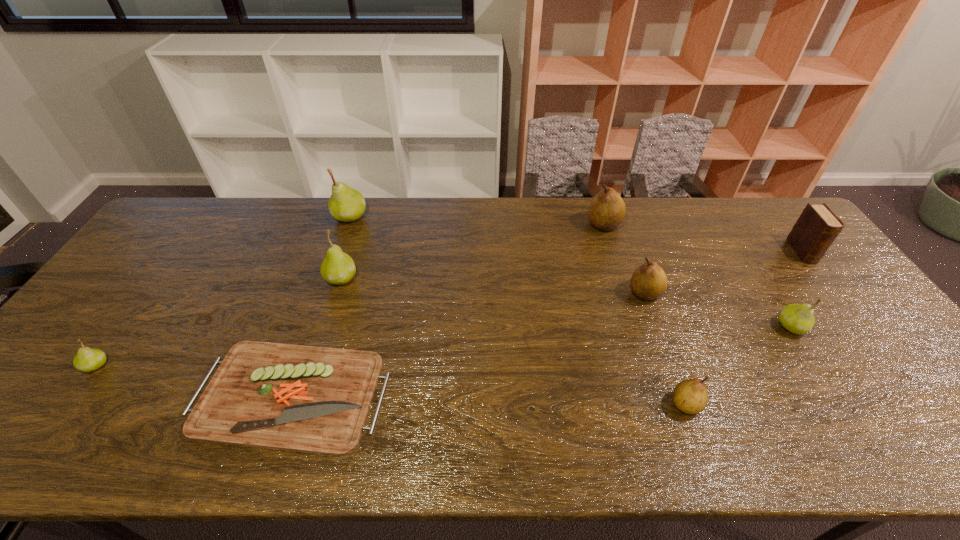
Locate an element on the screen. The height and width of the screenshot is (540, 960). free space between the leftmost object and the chopping board is located at coordinates (193, 380).

Find the location of `vacant point located between the third nearest green pear and the third farthest green pear`. vacant point located between the third nearest green pear and the third farthest green pear is located at coordinates (566, 302).

Where is `vacant point located between the seventh nearest object and the second nearest brown pear`? The width and height of the screenshot is (960, 540). vacant point located between the seventh nearest object and the second nearest brown pear is located at coordinates (724, 272).

The height and width of the screenshot is (540, 960). Identify the location of object that is the third closest to the shortest object. (346, 204).

You are a GUI agent. You are given a task and a screenshot of the screen. Output one action in this format:
    pyautogui.click(x=<x>, y=<y>)
    Task: Click on the object that is the third closest to the rightmost object
    
    Given the screenshot: What is the action you would take?
    pyautogui.click(x=607, y=209)

At what (x,y) coordinates should I click in order to perform the action: click on pear identified as the sixth closest to the nearest pear. Please return your answer as a coordinate pair (x, y). This screenshot has height=540, width=960. Looking at the image, I should click on (87, 359).

At what (x,y) coordinates should I click in order to perform the action: click on pear that is the fourth closest one to the third biggest green pear. Please return your answer as a coordinate pair (x, y). This screenshot has width=960, height=540. Looking at the image, I should click on (338, 267).

Where is `green pear object that ranks as the fourth closest to the shortest object`? green pear object that ranks as the fourth closest to the shortest object is located at coordinates (798, 319).

The image size is (960, 540). Identify the location of green pear that is the third nearest to the biggest brown pear. (346, 204).

Choose which brown pear is the nearest neighbor to the chopping board. Please provide its 2D coordinates. Your answer should be formatted as a tuple, i.e. [(x, y)], where the tuple contains the x and y coordinates of a point satisfying the conditions above.

[(649, 281)]